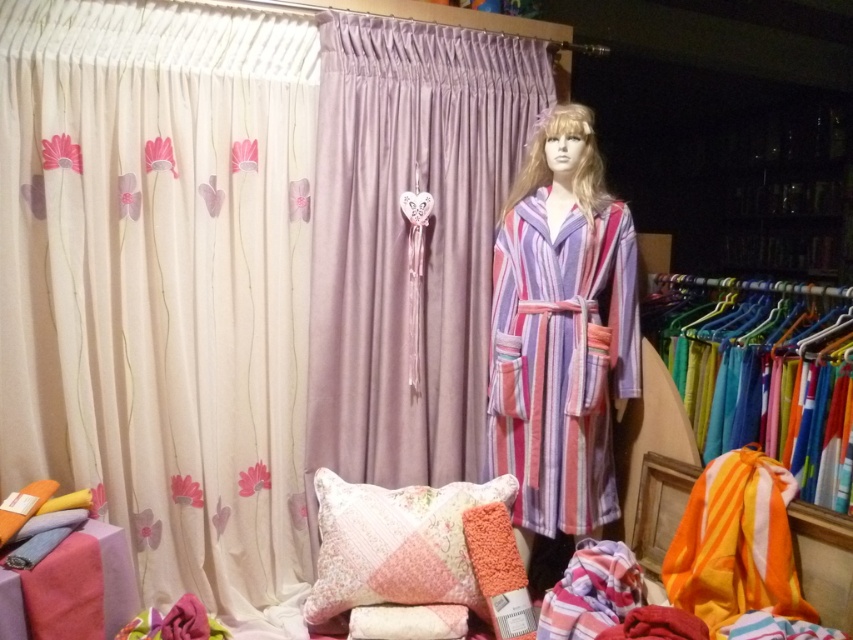
You are a store employee arranging items in the display. You need to ensure that the lavender satin curtain at center and the striped fabric robe at center are visible to customers. Given their sizes, which item should be placed higher up to avoid blocking the view of the other?

The lavender satin curtain at center is larger in size than the striped fabric robe at center. To ensure both items are visible, place the larger lavender satin curtain at center higher up so it doesn

You are a store employee arranging items in the display. You need to ensure that the creamy satin curtain at left is visible from the entrance. Since the striped fabric robe at center is blocking the view, where should you adjust the robe to make the curtain visible?

The creamy satin curtain at left is below the striped fabric robe at center, so moving the robe upwards would allow the curtain to be visible from the entrance.